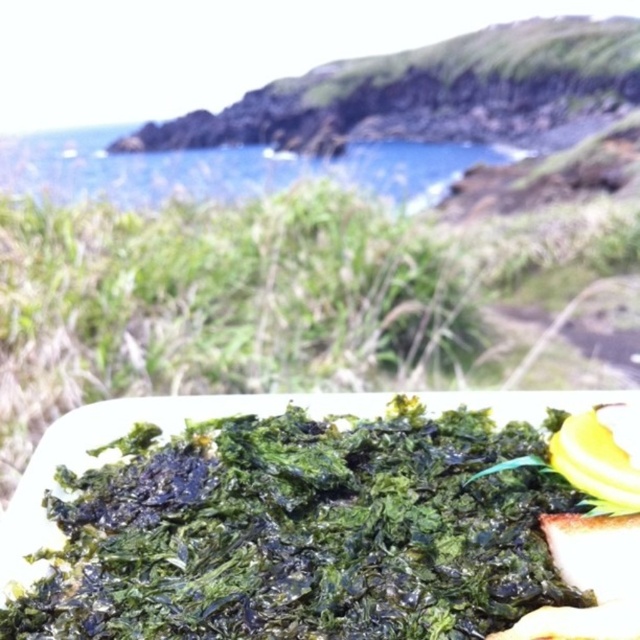
Question: Is the position of green crispy seaweed at bottom more distant than that of blue water at upper center?

Choices:
 (A) yes
 (B) no

Answer: (B)

Question: Can you confirm if green crispy seaweed at bottom is positioned to the left of blue water at upper center?

Choices:
 (A) no
 (B) yes

Answer: (A)

Question: Which object is closer to the camera taking this photo?

Choices:
 (A) blue water at upper center
 (B) green crispy seaweed at bottom

Answer: (B)

Question: Is green crispy seaweed at bottom wider than blue water at upper center?

Choices:
 (A) no
 (B) yes

Answer: (A)